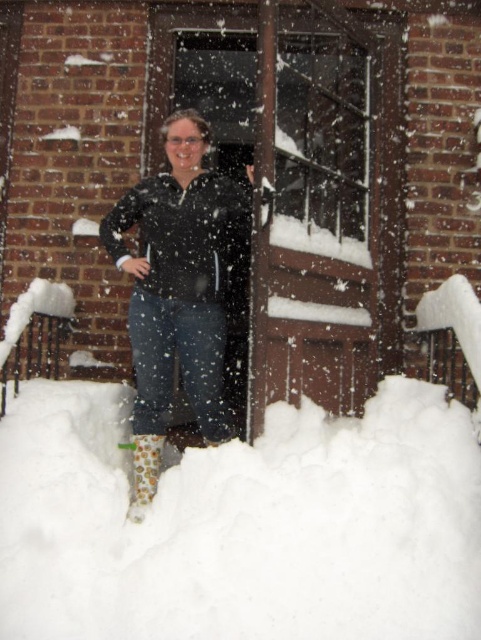
Question: Which object appears farthest from the camera in this image?

Choices:
 (A) white fluffy snow at lower center
 (B) matte black jacket at center

Answer: (B)

Question: Which of the following is the closest to the observer?

Choices:
 (A) (144, 637)
 (B) (147, 497)

Answer: (A)

Question: Is white fluffy snow at lower center to the right of matte black jacket at center from the viewer's perspective?

Choices:
 (A) yes
 (B) no

Answer: (A)

Question: Which object is closer to the camera taking this photo?

Choices:
 (A) camouflage-patterned boot at lower left
 (B) white fluffy snow at lower center
 (C) matte black jacket at center

Answer: (B)

Question: Is white fluffy snow at lower center closer to camera compared to camouflage-patterned boot at lower left?

Choices:
 (A) yes
 (B) no

Answer: (A)

Question: Can you confirm if matte black jacket at center is positioned to the left of camouflage-patterned boot at lower left?

Choices:
 (A) no
 (B) yes

Answer: (A)